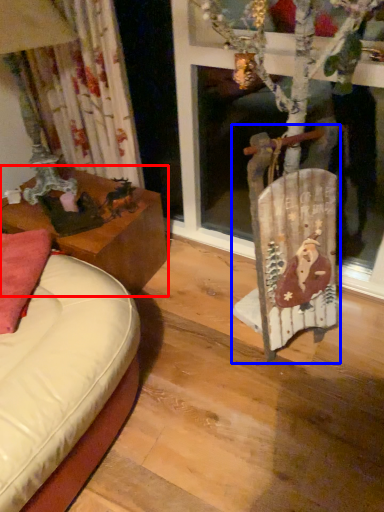
Question: Which object appears closest to the camera in this image, table (highlighted by a red box) or chair (highlighted by a blue box)?

Choices:
 (A) table
 (B) chair

Answer: (B)